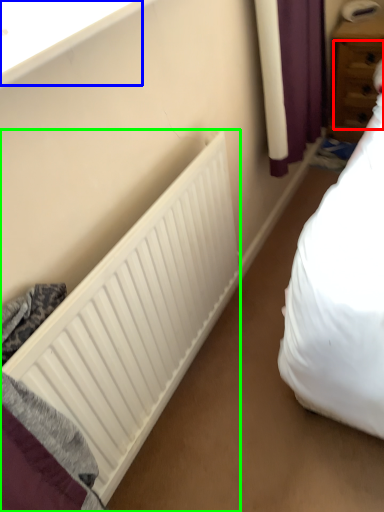
Question: Based on their relative distances, which object is nearer to drawer (highlighted by a red box)? Choose from window sill (highlighted by a blue box) and radiator (highlighted by a green box).

Choices:
 (A) window sill
 (B) radiator

Answer: (B)